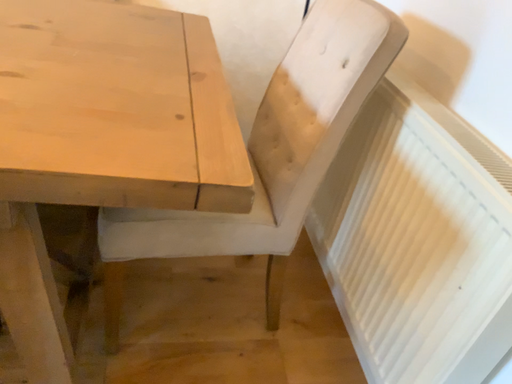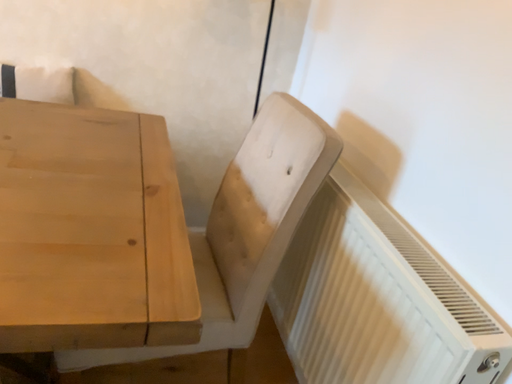
Question: Which way did the camera rotate in the video?

Choices:
 (A) rotated downward
 (B) rotated upward

Answer: (B)